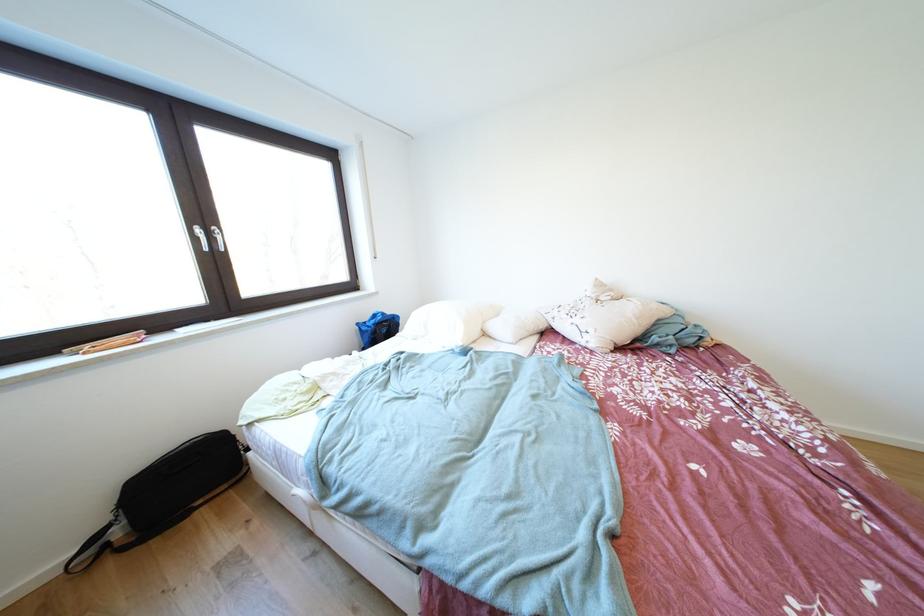
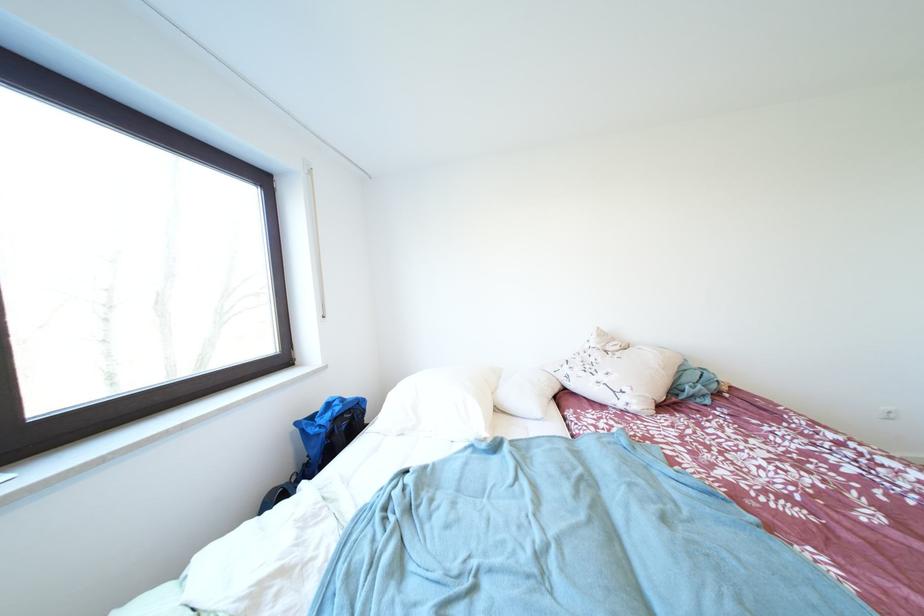
In a continuous first-person perspective shot, in which direction is the camera moving?

The cameraman walked toward left, forward.